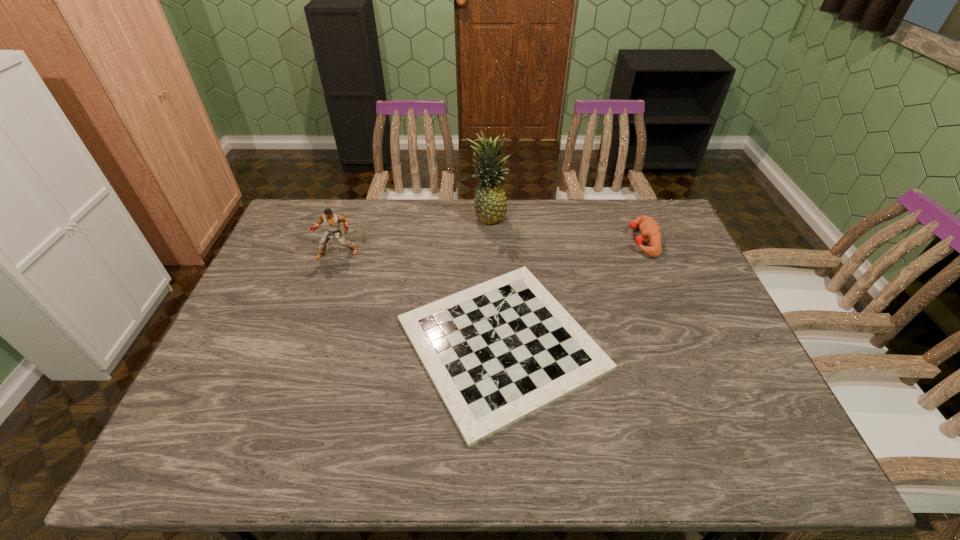
The image size is (960, 540). Identify the location of the tallest object. (490, 202).

Locate an element on the screen. the taller puncher is located at coordinates (332, 221).

Image resolution: width=960 pixels, height=540 pixels. I want to click on the leftmost object, so click(x=332, y=221).

Locate an element on the screen. The width and height of the screenshot is (960, 540). the shorter puncher is located at coordinates (650, 231).

What are the coordinates of `the third tallest object` in the screenshot? It's located at (650, 231).

I want to click on checkerboard, so click(497, 352).

Locate an element on the screen. The width and height of the screenshot is (960, 540). the nearest object is located at coordinates (497, 352).

Locate an element on the screen. This screenshot has height=540, width=960. vacant point located 0.240m on the left of the pineapple is located at coordinates (400, 216).

You are a GUI agent. You are given a task and a screenshot of the screen. Output one action in this format:
    pyautogui.click(x=<x>, y=<y>)
    Task: Click on the free space located on the front-facing side of the leftmost object
    Image resolution: width=960 pixels, height=540 pixels.
    Given the screenshot: What is the action you would take?
    pyautogui.click(x=322, y=298)

Locate an element on the screen. This screenshot has width=960, height=540. vacant space positioned 0.200m with the gloves of the shorter puncher facing forward is located at coordinates (569, 241).